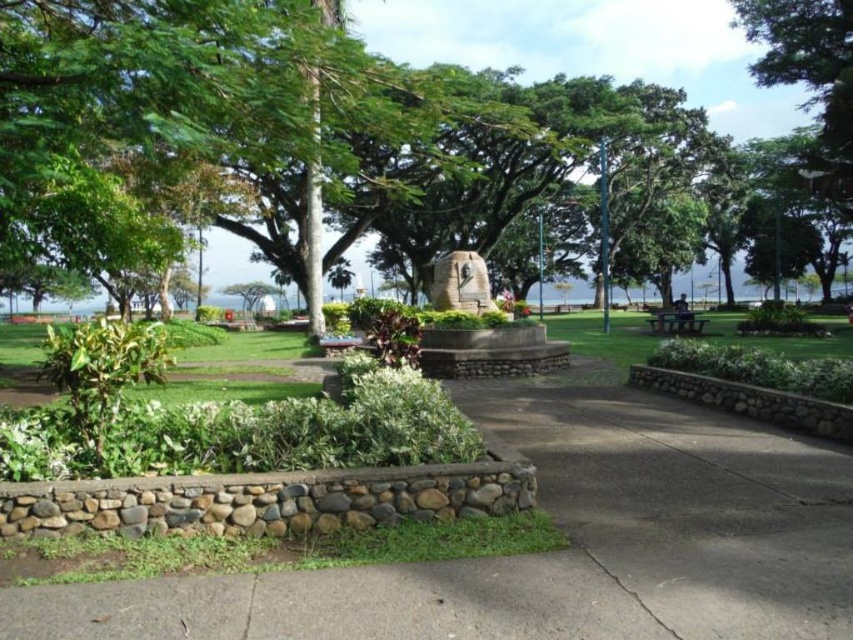
Is green stone bench at center wider than green leafy tree at center?

Incorrect, green stone bench at center's width does not surpass green leafy tree at center's.

Is green stone bench at center shorter than green leafy tree at center?

Yes, green stone bench at center is shorter than green leafy tree at center.

Who is more distant from viewer, (440, 628) or (653, 45)?

Positioned behind is point (653, 45).

Find the location of a particular element. This screenshot has height=640, width=853. green stone bench at center is located at coordinates (556, 552).

Which of these two, green leafy tree at center or rustic stone monument at center, stands shorter?

rustic stone monument at center is shorter.

Is point (369, 35) farther from camera compared to point (440, 280)?

That is True.

Find the location of a particular element. The width and height of the screenshot is (853, 640). green leafy tree at center is located at coordinates (595, 45).

Does point (770, 106) lie in front of point (666, 314)?

No, (770, 106) is further to viewer.

Between green leafy tree at center and wooden park bench at center, which one is positioned lower?

wooden park bench at center is below.

Find the location of a particular element. The width and height of the screenshot is (853, 640). green leafy tree at center is located at coordinates (595, 45).